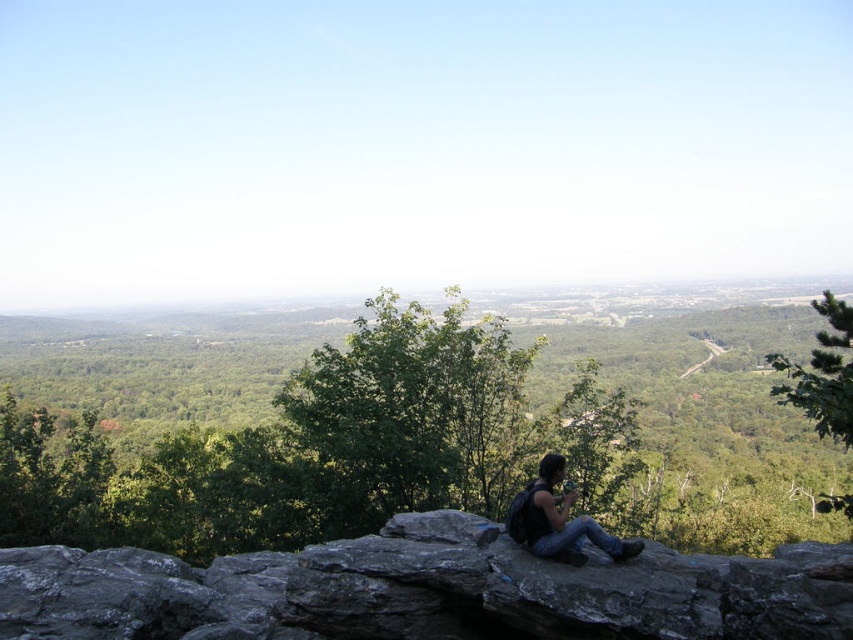
Does green leafy tree at center come behind dark gray rocky cliff at center?

That is True.

Can you confirm if green leafy tree at center is positioned to the left of dark gray rocky cliff at center?

Yes, green leafy tree at center is to the left of dark gray rocky cliff at center.

Is point (608, 513) farther from camera compared to point (152, 566)?

That is True.

Identify the location of green leafy tree at center. (421, 429).

From the picture: Does green leafy tree at upper right have a lesser height compared to black backpack at center?

No, green leafy tree at upper right is not shorter than black backpack at center.

Can you confirm if green leafy tree at upper right is positioned above black backpack at center?

Correct, green leafy tree at upper right is located above black backpack at center.

Describe the element at coordinates (822, 372) in the screenshot. The height and width of the screenshot is (640, 853). I see `green leafy tree at upper right` at that location.

Locate an element on the screen. This screenshot has height=640, width=853. green leafy tree at upper right is located at coordinates (822, 372).

Is green leafy tree at center shorter than green leafy tree at upper right?

No.

Can you confirm if green leafy tree at center is positioned to the right of green leafy tree at upper right?

Incorrect, green leafy tree at center is not on the right side of green leafy tree at upper right.

What do you see at coordinates (421, 429) in the screenshot? I see `green leafy tree at center` at bounding box center [421, 429].

In order to click on green leafy tree at center in this screenshot , I will do click(421, 429).